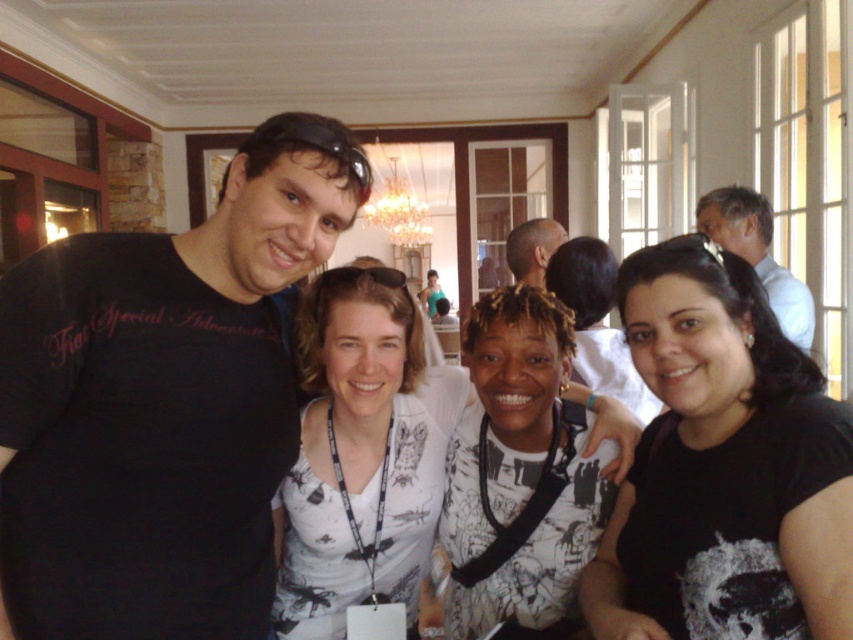
You are organizing a charity event and need to arrange two shirts on a display rack. The rack has a height limit of 1 meter. The black matte shirt at left is 30 cm tall, and the white printed shirt at center is 50 cm tall. Can both shirts fit vertically on the rack without exceeding the height limit?

The black matte shirt at left is 30 cm tall and the white printed shirt at center is 50 cm tall. Combined, they total 80 cm, which is under the 1 meter limit. Both shirts can fit vertically on the rack.

You are standing in the room and want to place a small sticker exactly at the point with coordinates (724,467). Which object in the scene should you place it on?

The point with coordinates (724,467) is located on the black matte shirt at lower right, so you should place the sticker there.

You are standing at point (328, 276) and want to take a photo of the group. The camera you have requires you to be at least 1.5 meters away from the subject to focus properly. Can you take a clear photo with your current position?

The distance between you at point (328, 276) and the camera is 1.60 meters, which meets the minimum requirement of 1.5 meters. Therefore, you can take a clear photo from your current position.